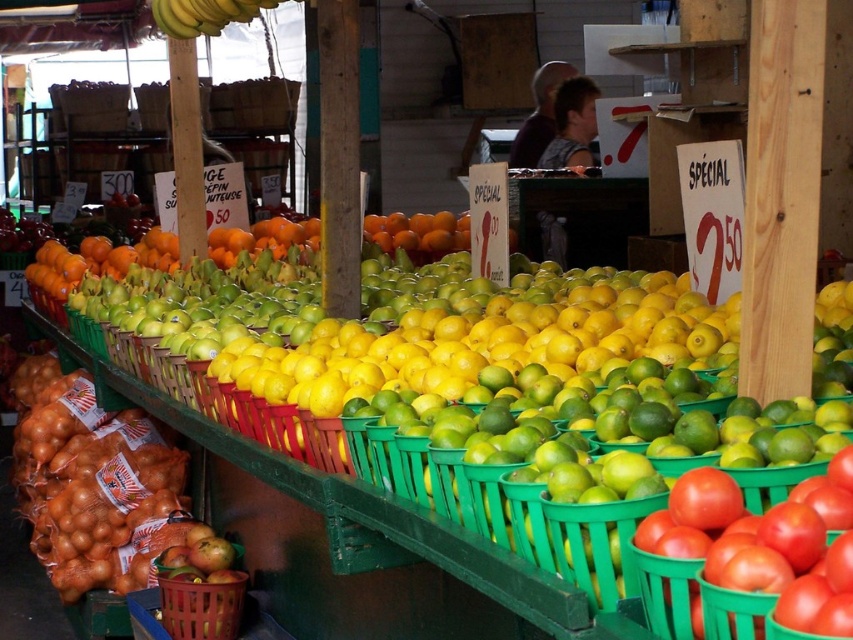
You are a customer at the fruit stand and want to know which item is wider between the shiny red tomato at lower right and the matte brown basket at lower left. Can you tell me?

The shiny red tomato at lower right has a lesser width compared to the matte brown basket at lower left, so the matte brown basket at lower left is wider.

You are a customer at the fruit stand and want to choose between the brown papery onion at lower left and the shiny red tomato at lower right based on their size. Which one is wider?

The brown papery onion at lower left might be wider than shiny red tomato at lower right.

Where is the shiny red tomato at lower right located in the image?

The shiny red tomato at lower right is located at point (759, 550).